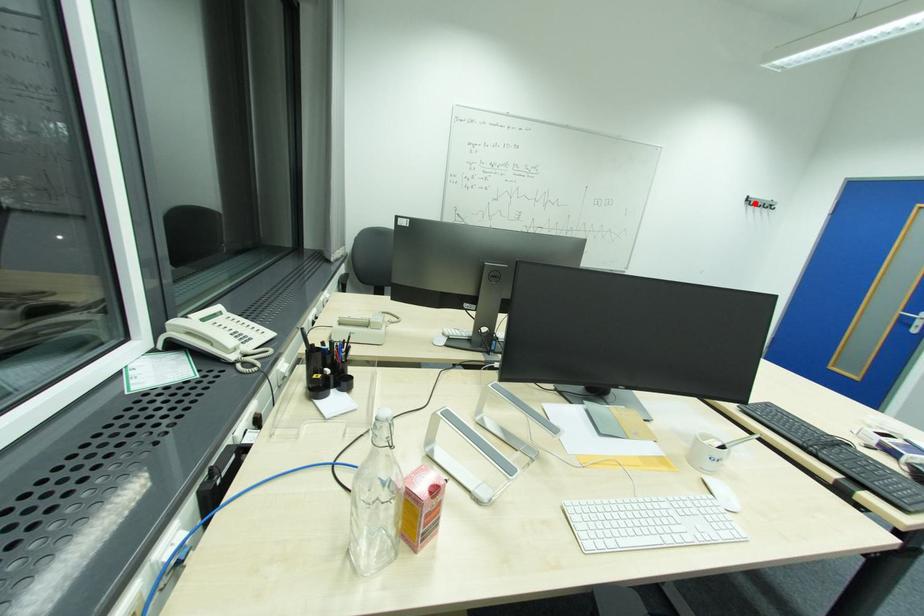
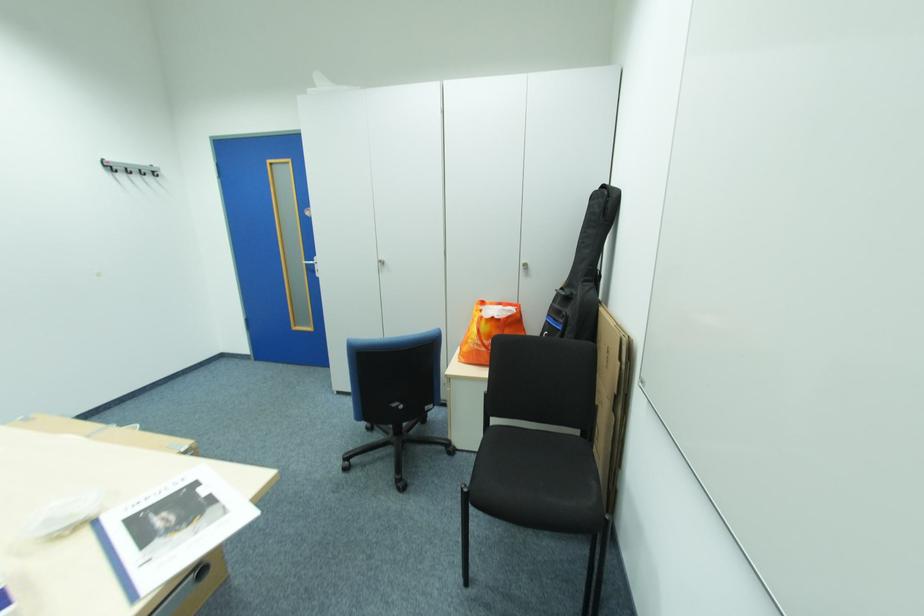
Find the pixel in the second image that matches the highlighted location in the first image.

(114, 171)